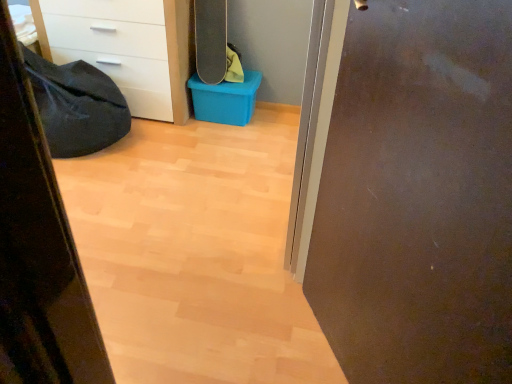
Question: Can you confirm if matte brown door at right is thinner than white glossy chest of drawers at upper left?

Choices:
 (A) yes
 (B) no

Answer: (A)

Question: From the image's perspective, is matte brown door at right over white glossy chest of drawers at upper left?

Choices:
 (A) no
 (B) yes

Answer: (A)

Question: Are matte brown door at right and white glossy chest of drawers at upper left beside each other?

Choices:
 (A) yes
 (B) no

Answer: (B)

Question: Is the depth of matte brown door at right less than that of white glossy chest of drawers at upper left?

Choices:
 (A) yes
 (B) no

Answer: (A)

Question: Is white glossy chest of drawers at upper left surrounded by matte brown door at right?

Choices:
 (A) yes
 (B) no

Answer: (B)

Question: Does matte brown door at right turn towards white glossy chest of drawers at upper left?

Choices:
 (A) no
 (B) yes

Answer: (A)

Question: From a real-world perspective, is white glossy chest of drawers at upper left over black matte skateboard at upper center?

Choices:
 (A) yes
 (B) no

Answer: (B)

Question: Does white glossy chest of drawers at upper left appear on the right side of black matte skateboard at upper center?

Choices:
 (A) no
 (B) yes

Answer: (A)

Question: Can you confirm if white glossy chest of drawers at upper left is bigger than black matte skateboard at upper center?

Choices:
 (A) no
 (B) yes

Answer: (B)

Question: Is white glossy chest of drawers at upper left looking in the opposite direction of black matte skateboard at upper center?

Choices:
 (A) yes
 (B) no

Answer: (B)

Question: Is black matte skateboard at upper center surrounded by white glossy chest of drawers at upper left?

Choices:
 (A) no
 (B) yes

Answer: (A)

Question: From a real-world perspective, is white glossy chest of drawers at upper left under black matte skateboard at upper center?

Choices:
 (A) no
 (B) yes

Answer: (B)

Question: Is the position of matte brown door at right more distant than that of blue plastic storage box at center?

Choices:
 (A) no
 (B) yes

Answer: (A)